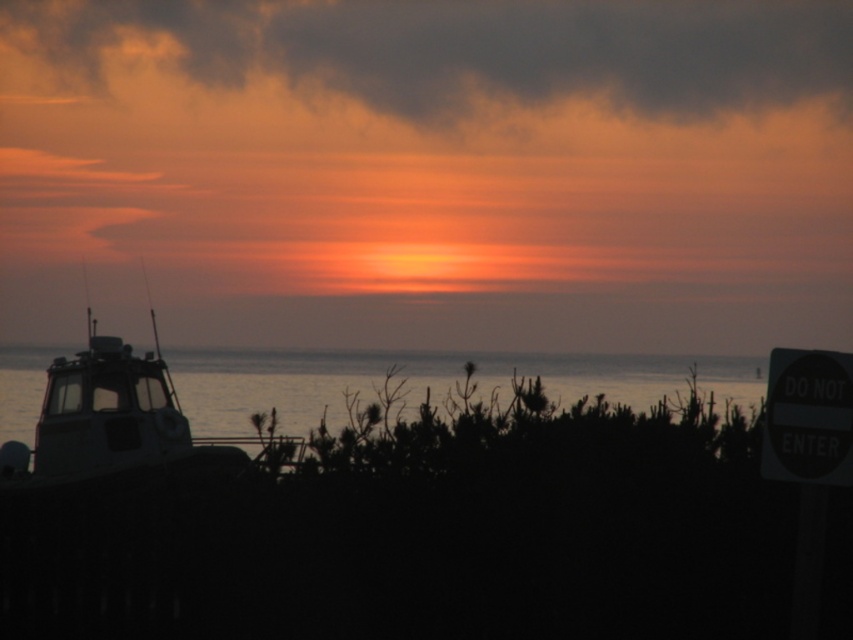
You are an observer looking at the sunset scene. You notice the cloudy sky at upper center and the silhouette metal boat at left. Which object is closer to you?

The cloudy sky at upper center is closer to you because the silhouette metal boat at left is behind it.

In the scene shown: You are an astronomer observing the sunset and notice the cloudy sky at upper center and the silhouette metal boat at left. Which object appears larger in the sky?

The silhouette metal boat at left appears larger than the cloudy sky at upper center because the cloudy sky at upper center has a smaller size compared to the silhouette metal boat at left.